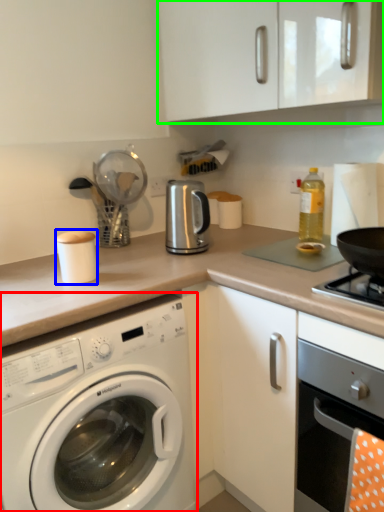
Question: Estimate the real-world distances between objects in this image. Which object is farther from washing machine (highlighted by a red box), appliance (highlighted by a blue box) or cabinetry (highlighted by a green box)?

Choices:
 (A) appliance
 (B) cabinetry

Answer: (B)